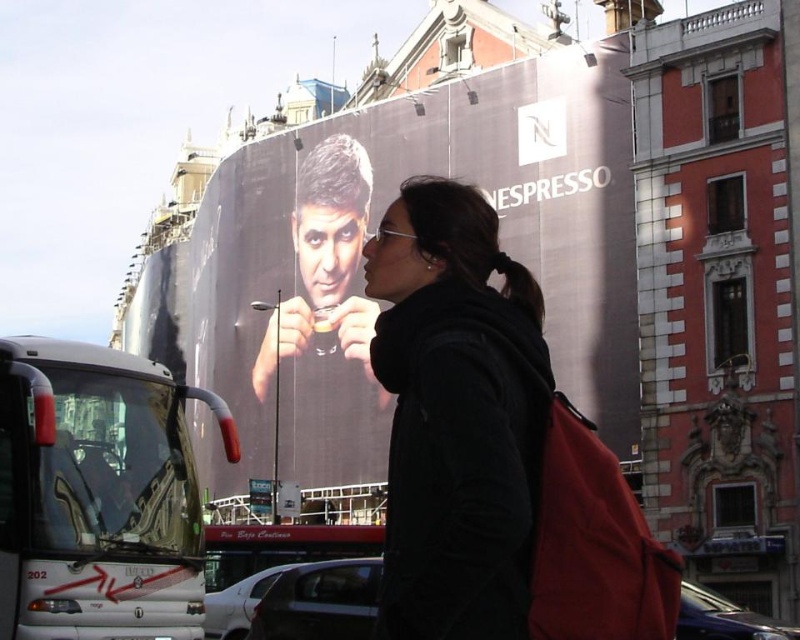
Question: Can you confirm if matte black billboard at center is positioned above black matte jacket at center?

Choices:
 (A) yes
 (B) no

Answer: (A)

Question: Can you confirm if matte black billboard at center is bigger than white glossy bus at lower left?

Choices:
 (A) no
 (B) yes

Answer: (B)

Question: Which point is farther to the camera?

Choices:
 (A) (536, 65)
 (B) (372, 362)
 (C) (56, 525)

Answer: (A)

Question: Does black matte jacket at center have a larger size compared to white glossy bus at lower left?

Choices:
 (A) no
 (B) yes

Answer: (B)

Question: Which point appears farthest from the camera in this image?

Choices:
 (A) (460, 445)
 (B) (106, 477)
 (C) (610, 244)

Answer: (C)

Question: Which point is farther from the camera taking this photo?

Choices:
 (A) (314, 353)
 (B) (12, 420)
 (C) (426, 368)

Answer: (A)